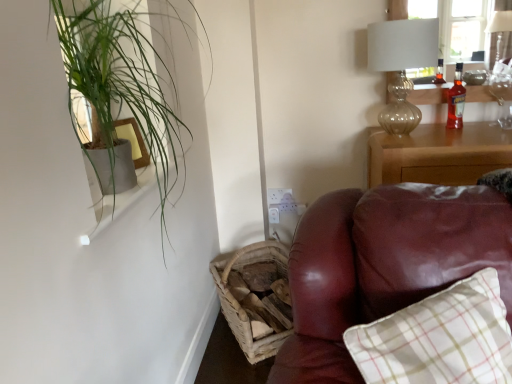
This screenshot has height=384, width=512. Identify the location of free point behind translucent amber glass bottle at upper right. (437, 128).